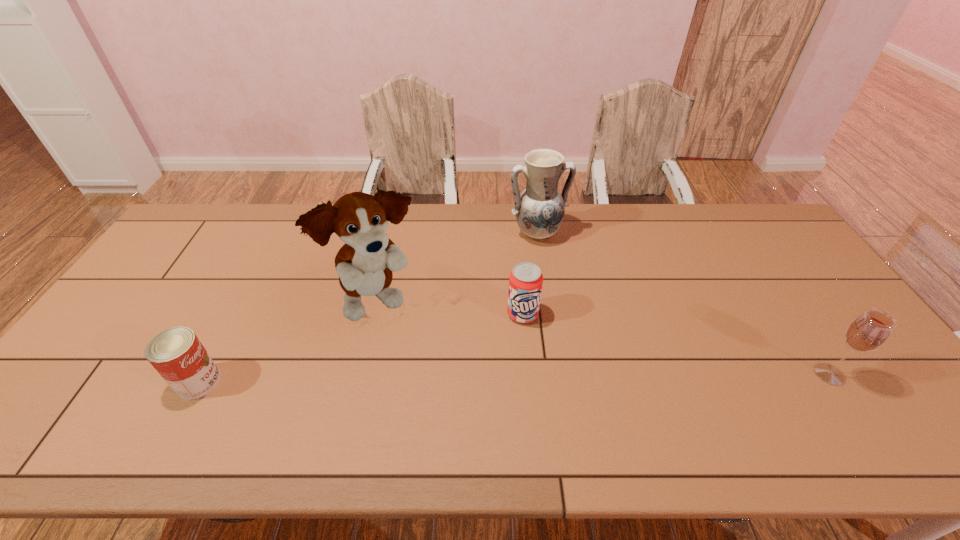
I want to click on vacant space in between the second tallest object and the second object from left to right, so click(458, 267).

This screenshot has height=540, width=960. Identify the location of empty space that is in between the puppy and the soda can. (451, 307).

In order to click on free space between the can and the farthest object in this screenshot , I will do `click(368, 308)`.

Find the location of `empty location between the tallest object and the soda can`. empty location between the tallest object and the soda can is located at coordinates (451, 307).

This screenshot has height=540, width=960. In order to click on unoccupied position between the soda can and the second object from left to right in this screenshot , I will do `click(451, 307)`.

Find the location of a particular element. free space between the can and the puppy is located at coordinates (289, 341).

Where is `free space between the can and the soda can`? The height and width of the screenshot is (540, 960). free space between the can and the soda can is located at coordinates (361, 348).

Where is `empty location between the fourth object from right to left and the second tallest object`? The height and width of the screenshot is (540, 960). empty location between the fourth object from right to left and the second tallest object is located at coordinates (458, 267).

Identify the location of free space between the can and the puppy. This screenshot has height=540, width=960. (289, 341).

Find the location of `the closest object to the leftmost object`. the closest object to the leftmost object is located at coordinates (364, 264).